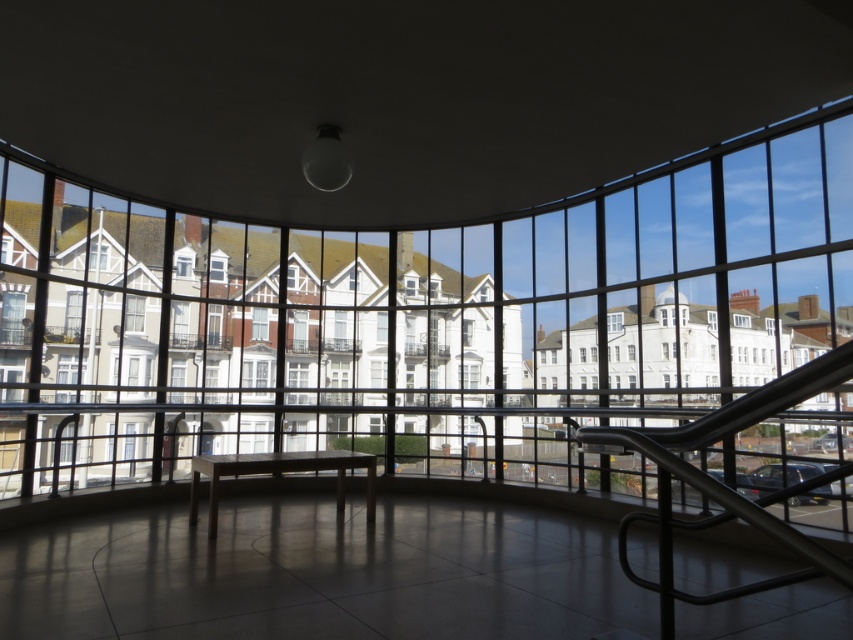
From the picture: You are an interior designer planning to place a 1.2 meter wide sofa in this room. The sofa must be placed between the wooden at center and the clear glass window at upper left. Can the space between them accommodate the sofa?

The wooden at center is thinner than the clear glass window at upper left. However, the description does not provide the exact distance between them. Without knowing the actual space between the two objects, it is impossible to determine if the sofa will fit.

You are an interior designer planning to hang a large mirror on the wall. You have two options for placement based on the objects in the room. The first option is above the wooden at center, and the second is near the clear glass window at upper left. Considering their heights, which placement would allow the mirror to be hung higher?

The clear glass window at upper left is taller than the wooden at center, so placing the mirror near the clear glass window at upper left would allow it to be hung higher.